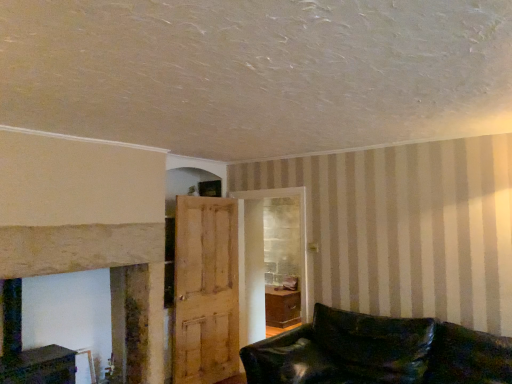
Question: From a real-world perspective, is light brown wooden door at center located higher than smooth stone fireplace at left?

Choices:
 (A) yes
 (B) no

Answer: (B)

Question: Can you confirm if light brown wooden door at center is shorter than smooth stone fireplace at left?

Choices:
 (A) no
 (B) yes

Answer: (B)

Question: Does light brown wooden door at center have a greater height compared to smooth stone fireplace at left?

Choices:
 (A) no
 (B) yes

Answer: (A)

Question: Is light brown wooden door at center positioned far away from smooth stone fireplace at left?

Choices:
 (A) yes
 (B) no

Answer: (B)

Question: Does light brown wooden door at center appear on the right side of smooth stone fireplace at left?

Choices:
 (A) no
 (B) yes

Answer: (B)

Question: Considering the relative positions of leather couch at lower right and light brown wooden door at center in the image provided, is leather couch at lower right to the left or to the right of light brown wooden door at center?

Choices:
 (A) left
 (B) right

Answer: (B)

Question: Considering the positions of leather couch at lower right and light brown wooden door at center in the image, is leather couch at lower right taller or shorter than light brown wooden door at center?

Choices:
 (A) short
 (B) tall

Answer: (A)

Question: From a real-world perspective, is leather couch at lower right above or below light brown wooden door at center?

Choices:
 (A) below
 (B) above

Answer: (A)

Question: Considering the positions of leather couch at lower right and light brown wooden door at center in the image, is leather couch at lower right wider or thinner than light brown wooden door at center?

Choices:
 (A) wide
 (B) thin

Answer: (A)

Question: Relative to leather couch at lower right, is smooth stone fireplace at left in front or behind?

Choices:
 (A) front
 (B) behind

Answer: (B)

Question: From the image's perspective, is smooth stone fireplace at left located above or below leather couch at lower right?

Choices:
 (A) above
 (B) below

Answer: (A)

Question: Is smooth stone fireplace at left taller or shorter than leather couch at lower right?

Choices:
 (A) short
 (B) tall

Answer: (B)

Question: Considering the positions of smooth stone fireplace at left and leather couch at lower right in the image, is smooth stone fireplace at left wider or thinner than leather couch at lower right?

Choices:
 (A) wide
 (B) thin

Answer: (B)

Question: In the image, is smooth stone fireplace at left positioned in front of or behind light brown wooden door at center?

Choices:
 (A) front
 (B) behind

Answer: (A)

Question: Looking at their shapes, would you say smooth stone fireplace at left is wider or thinner than light brown wooden door at center?

Choices:
 (A) wide
 (B) thin

Answer: (A)